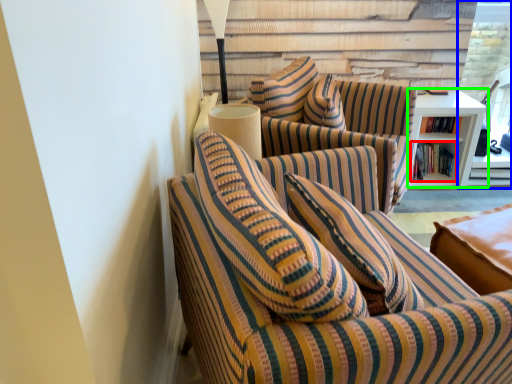
Question: Which is nearer to the book (highlighted by a red box)? glass door (highlighted by a blue box) or table (highlighted by a green box).

Choices:
 (A) glass door
 (B) table

Answer: (B)